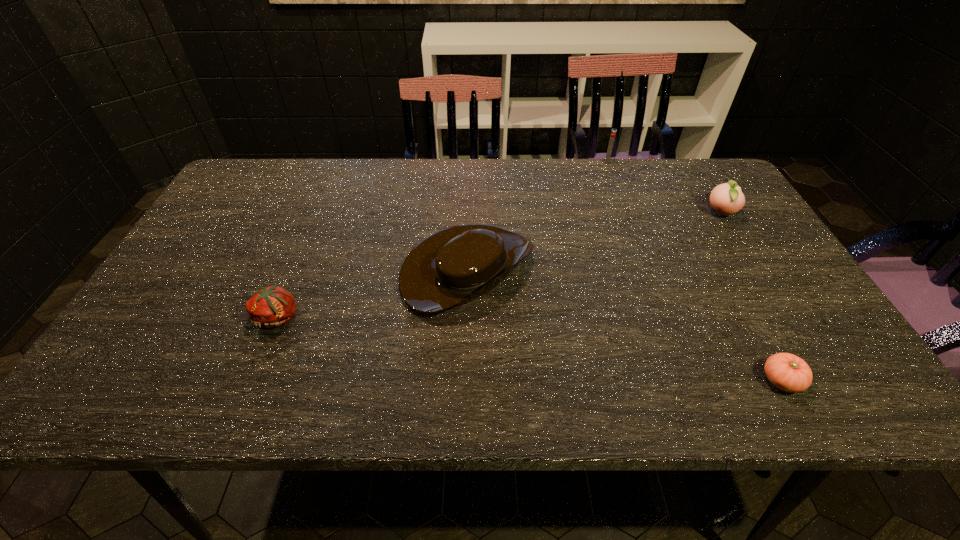
Identify the location of free location located on the back of the fourth object from right to left. The width and height of the screenshot is (960, 540). coord(469,205).

At what (x,y) coordinates should I click in order to perform the action: click on vacant area located 0.340m on the back of the farther tomato. Please return your answer as a coordinate pair (x, y). This screenshot has width=960, height=540. Looking at the image, I should click on (323, 210).

Locate an element on the screen. vacant space located 0.070m on the back of the right tomato is located at coordinates (756, 335).

This screenshot has width=960, height=540. Identify the location of object at the far edge. (x=613, y=133).

I want to click on object that is at the near edge, so click(786, 371).

You are a GUI agent. You are given a task and a screenshot of the screen. Output one action in this format:
    pyautogui.click(x=<x>, y=<y>)
    Task: Click on the peach located at the right edge
    
    Given the screenshot: What is the action you would take?
    pyautogui.click(x=726, y=199)

I want to click on tomato located in the right edge section of the desktop, so click(x=786, y=371).

This screenshot has height=540, width=960. What are the coordinates of `object present at the near right corner` in the screenshot? It's located at [786, 371].

Locate an element on the screen. free space at the far edge of the desktop is located at coordinates (279, 199).

The image size is (960, 540). What are the coordinates of `vacant space at the near edge of the desktop` in the screenshot? It's located at (568, 401).